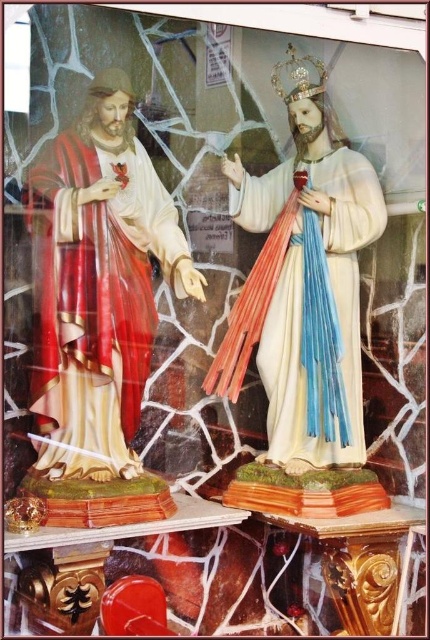
You are an art conservator examining the statues through the cracked glass window. You notice the shiny red fabric robe at left and the gold metallic crown at upper center. Which object is taller?

The shiny red fabric robe at left is taller than the gold metallic crown at upper center.

You are an art curator planning to move the shiny red fabric robe at left and the white glossy robe at center to a new exhibition space. The new space has a narrow corridor that only allows items to be moved one at a time. Based on their positions in the current image, which robe should you move first to ensure the other can be moved without obstruction?

You should move the shiny red fabric robe at left first. Since it is to the left of the white glossy robe at center, moving it first allows the white glossy robe at center to be accessed and moved afterward without obstruction.

You are an art conservator examining the statues. You need to place a protective barrier between the white glossy robe at center and the gold metallic crown at upper center. Based on their positions, which object should the barrier be closer to?

The white glossy robe at center is to the right of the gold metallic crown at upper center, so the barrier should be placed closer to the gold metallic crown at upper center to separate them.